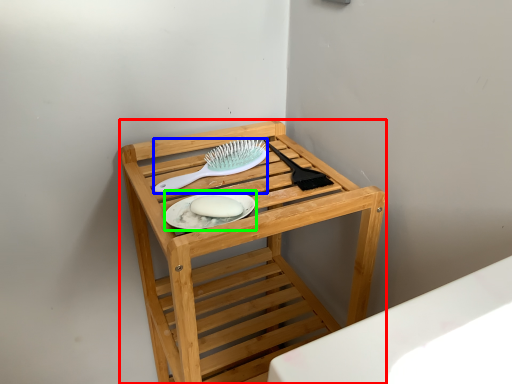
Question: Which object is positioned farthest from furniture (highlighted by a red box)? Select from brush (highlighted by a blue box) and platter (highlighted by a green box).

Choices:
 (A) brush
 (B) platter

Answer: (B)